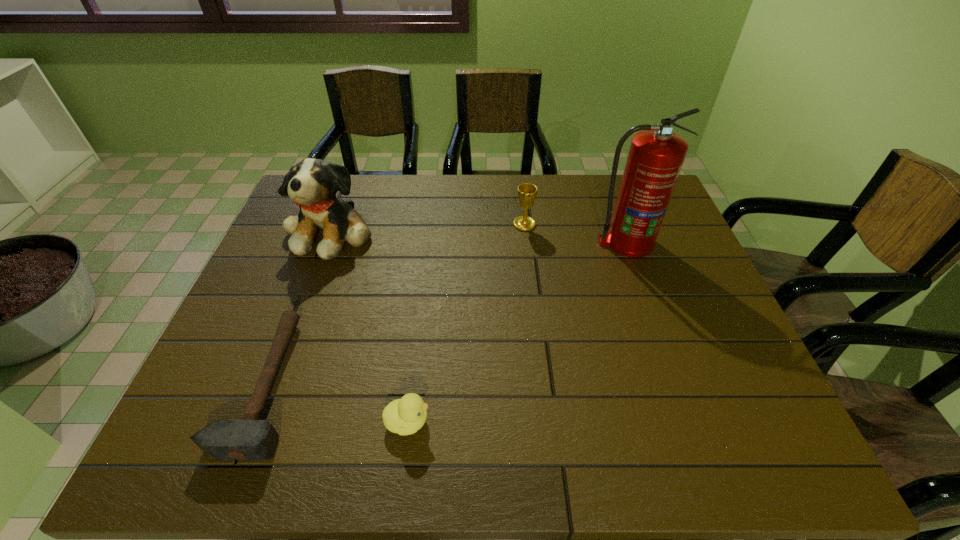
The height and width of the screenshot is (540, 960). What are the coordinates of `object situated at the far left corner` in the screenshot? It's located at (312, 183).

Where is `object present at the near left corner`? The width and height of the screenshot is (960, 540). object present at the near left corner is located at coordinates (250, 438).

In the image, there is a desktop. What are the coordinates of `vacant space at the far edge` in the screenshot? It's located at (362, 215).

Image resolution: width=960 pixels, height=540 pixels. In the image, there is a desktop. In order to click on vacant space at the near edge in this screenshot , I will do `click(437, 463)`.

Locate an element on the screen. The height and width of the screenshot is (540, 960). free spot at the left edge of the desktop is located at coordinates (302, 263).

At what (x,y) coordinates should I click in order to perform the action: click on free space at the right edge. Please return your answer as a coordinate pair (x, y). This screenshot has height=540, width=960. Looking at the image, I should click on (668, 347).

Find the location of a particular element. This screenshot has width=960, height=540. vacant region between the hammer and the tallest object is located at coordinates (446, 314).

You are a GUI agent. You are given a task and a screenshot of the screen. Output one action in this format:
    pyautogui.click(x=<x>, y=<y>)
    Task: Click on the vacant space that is in between the shortest object and the fourth object from left to right
    
    Given the screenshot: What is the action you would take?
    pyautogui.click(x=395, y=305)

The image size is (960, 540). I want to click on empty space between the hammer and the chalice, so click(x=395, y=305).

Image resolution: width=960 pixels, height=540 pixels. Identify the location of vacant area between the puppy and the tallest object. (479, 237).